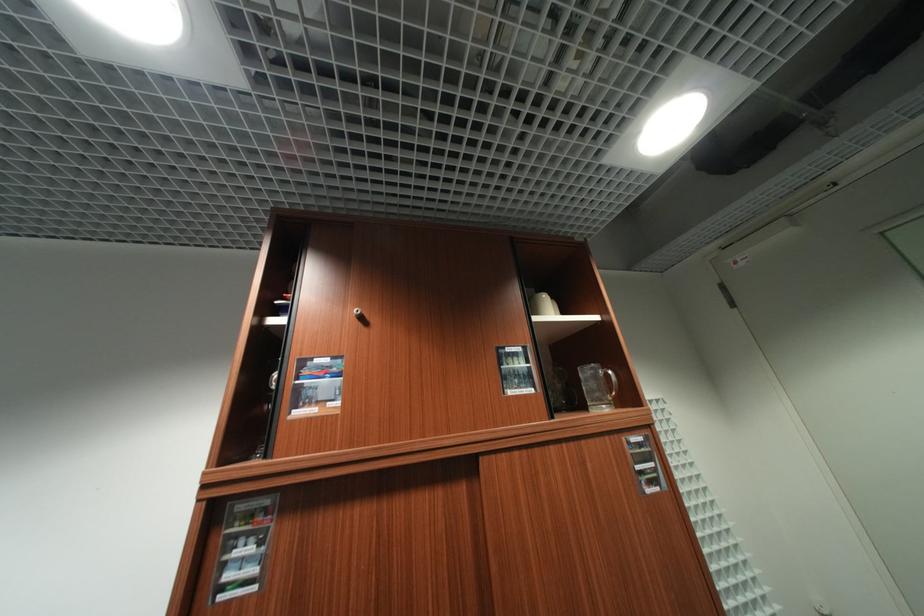
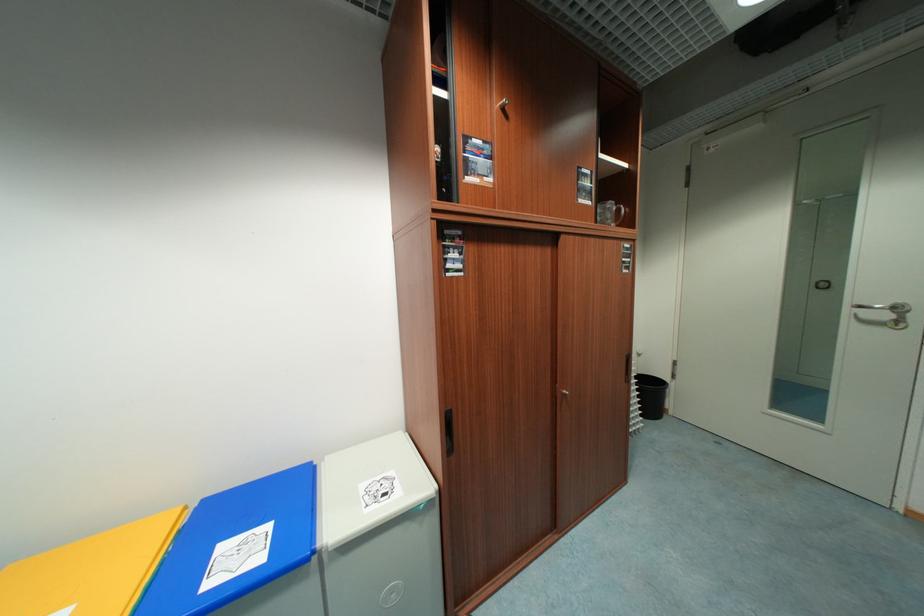
Where in the second image is the point corresponding to (613,377) from the first image?

(624, 211)